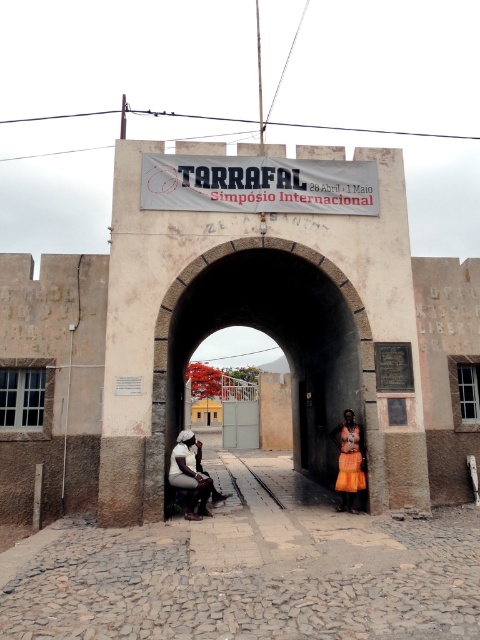
You are standing in front of the entrance to Tarrafal and notice the stone archway at center and the orange fabric skirt at center. Which object is shorter in height?

The stone archway at center has a lesser height compared to the orange fabric skirt at center, so the stone archway at center is shorter.

You are standing at the entrance of Tarrafal and want to take a photo of the stone archway at center. According to the coordinates provided, where exactly should you position yourself to capture the archway in the center of your frame?

The stone archway at center is located at point (278, 342), so you should position yourself directly in front of that coordinate to center it in your photo.